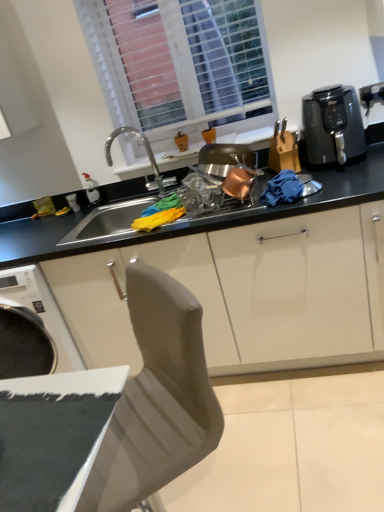
Question: Does black matte countertop at center have a smaller size compared to black plastic air fryer at upper right?

Choices:
 (A) no
 (B) yes

Answer: (B)

Question: Could you tell me if black matte countertop at center is turned towards black plastic air fryer at upper right?

Choices:
 (A) no
 (B) yes

Answer: (A)

Question: Does black matte countertop at center appear on the right side of black plastic air fryer at upper right?

Choices:
 (A) no
 (B) yes

Answer: (A)

Question: Is black matte countertop at center closer to camera compared to black plastic air fryer at upper right?

Choices:
 (A) yes
 (B) no

Answer: (B)

Question: From the image's perspective, is black matte countertop at center beneath black plastic air fryer at upper right?

Choices:
 (A) no
 (B) yes

Answer: (B)

Question: Considering the relative sizes of black matte countertop at center and black plastic air fryer at upper right in the image provided, is black matte countertop at center wider than black plastic air fryer at upper right?

Choices:
 (A) no
 (B) yes

Answer: (A)

Question: From the image's perspective, is black plastic knife block at right under white plastic window at upper center?

Choices:
 (A) yes
 (B) no

Answer: (A)

Question: Considering the relative positions of black plastic knife block at right and white plastic window at upper center in the image provided, is black plastic knife block at right to the left of white plastic window at upper center from the viewer's perspective?

Choices:
 (A) yes
 (B) no

Answer: (B)

Question: Is black plastic knife block at right bigger than white plastic window at upper center?

Choices:
 (A) no
 (B) yes

Answer: (A)

Question: Is black plastic knife block at right next to white plastic window at upper center and touching it?

Choices:
 (A) no
 (B) yes

Answer: (A)

Question: Does black plastic knife block at right have a smaller size compared to white plastic window at upper center?

Choices:
 (A) no
 (B) yes

Answer: (B)

Question: Is black plastic knife block at right in front of white plastic window at upper center?

Choices:
 (A) yes
 (B) no

Answer: (A)

Question: From the image's perspective, would you say black matte countertop at center is shown under white plastic window at upper center?

Choices:
 (A) no
 (B) yes

Answer: (B)